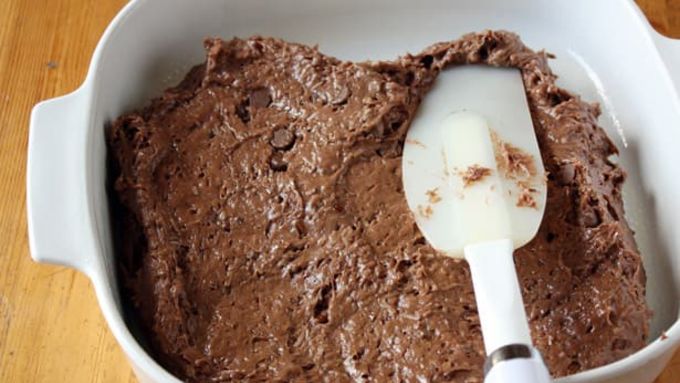
This screenshot has width=680, height=383. Find the location of `table`. table is located at coordinates pos(47,52).